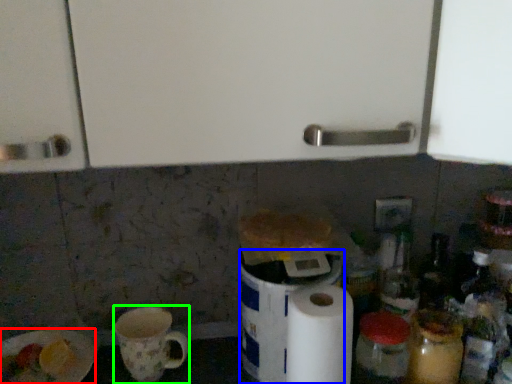
Question: Based on their relative distances, which object is farther from paper plate (highlighted by a red box)? Choose from appliance (highlighted by a blue box) and mug (highlighted by a green box).

Choices:
 (A) appliance
 (B) mug

Answer: (A)